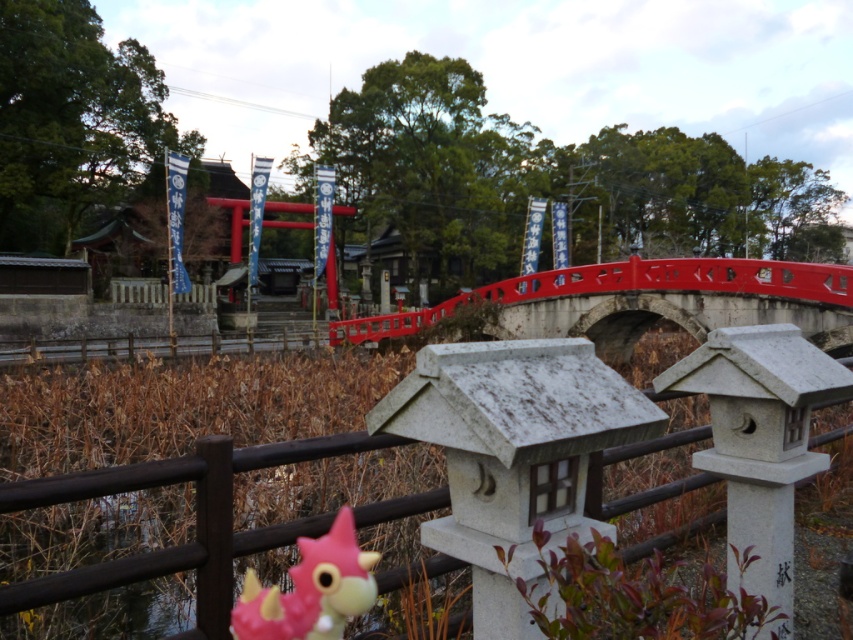
You are a visitor at the shrine and want to place a new offering between the brown wooden fence at lower center and the pink matte toy at center. Which object should you place the offering closer to if you want it to be near the wider object?

The brown wooden fence at lower center is wider than the pink matte toy at center, so you should place the offering closer to the brown wooden fence at lower center.

In the scene shown: You are a small robot with a width of 30 centimeters. You are currently standing near the brown wooden fence at lower center and want to reach the pink matte toy at center. Can you move directly to the toy without any obstacles in between?

The distance between the brown wooden fence at lower center and the pink matte toy at center is 41.80 centimeters. Since the robot is 30 centimeters wide, there is enough space for it to move directly to the toy without obstacles.